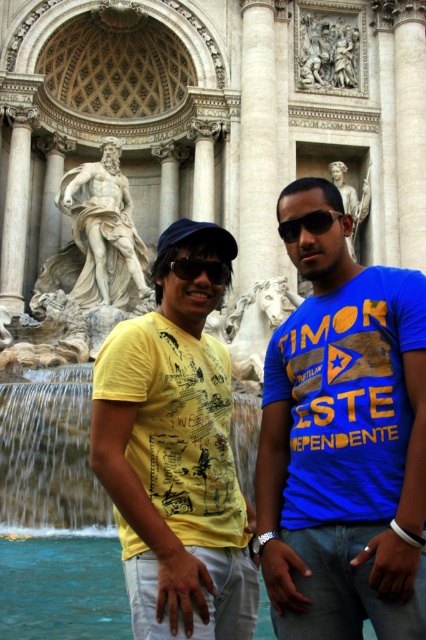
Question: Among these points, which one is farthest from the camera?

Choices:
 (A) (109, 460)
 (B) (31, 524)

Answer: (B)

Question: Observing the image, what is the correct spatial positioning of yellow printed t-shirt at center in reference to translucent water at center?

Choices:
 (A) right
 (B) left

Answer: (A)

Question: Can you confirm if yellow printed t-shirt at center is positioned above black plastic sunglasses at center?

Choices:
 (A) yes
 (B) no

Answer: (B)

Question: Which point is farther from the camera taking this photo?

Choices:
 (A) (262, 547)
 (B) (23, 260)
 (C) (117, 179)
 (D) (186, 266)

Answer: (C)

Question: Can you confirm if blue cotton shirt at center is positioned to the left of translucent water at center?

Choices:
 (A) no
 (B) yes

Answer: (A)

Question: Which object is farther from the camera taking this photo?

Choices:
 (A) blue cotton shirt at center
 (B) white marble statue at center
 (C) black plastic sunglasses at center
 (D) white marble column at left

Answer: (B)